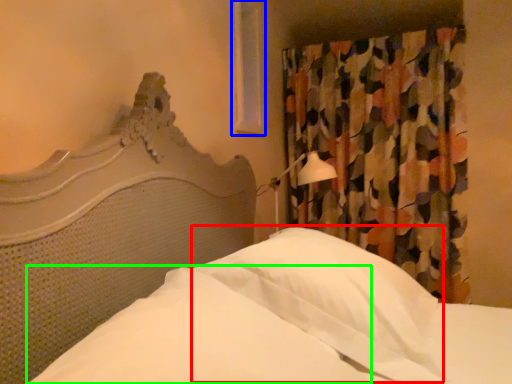
Question: Which object is positioned farthest from pillow (highlighted by a red box)? Select from window (highlighted by a blue box) and sheet (highlighted by a green box).

Choices:
 (A) window
 (B) sheet

Answer: (A)